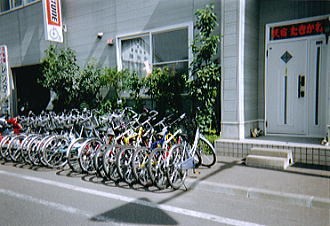
Where is `open garage door`? open garage door is located at coordinates (31, 88).